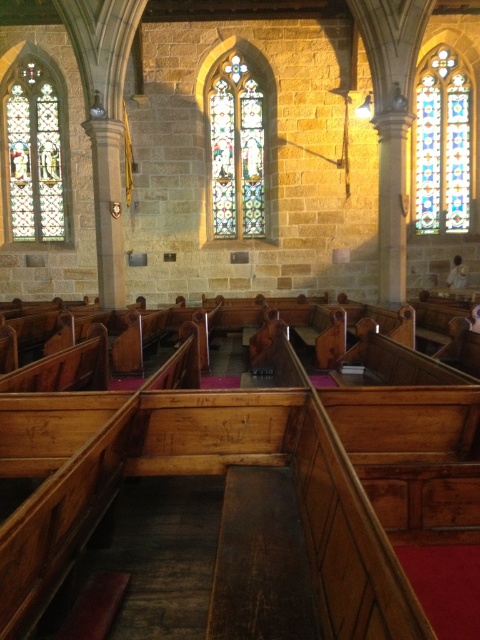
Is point (215, 124) farther from viewer compared to point (454, 269)?

Yes, it is behind point (454, 269).

Is point (216, 106) closer to viewer compared to point (460, 260)?

No.

Find the location of `stained glass window at center`. stained glass window at center is located at coordinates (236, 150).

Which of these two, stained glass window at left or stained glass window at center, stands shorter?

Standing shorter between the two is stained glass window at center.

What do you see at coordinates (34, 156) in the screenshot? I see `stained glass window at left` at bounding box center [34, 156].

Who is more distant from viewer, [10,168] or [229,141]?

The point [10,168] is behind.

This screenshot has width=480, height=640. What are the coordinates of `stained glass window at left` in the screenshot? It's located at (34, 156).

Does stained glass window at upper right have a lesser height compared to smooth wooden pew at center?

Incorrect, stained glass window at upper right's height does not fall short of smooth wooden pew at center's.

Can you confirm if stained glass window at upper right is taller than smooth wooden pew at center?

Yes, stained glass window at upper right is taller than smooth wooden pew at center.

Locate an element on the screen. This screenshot has width=480, height=640. stained glass window at upper right is located at coordinates (443, 145).